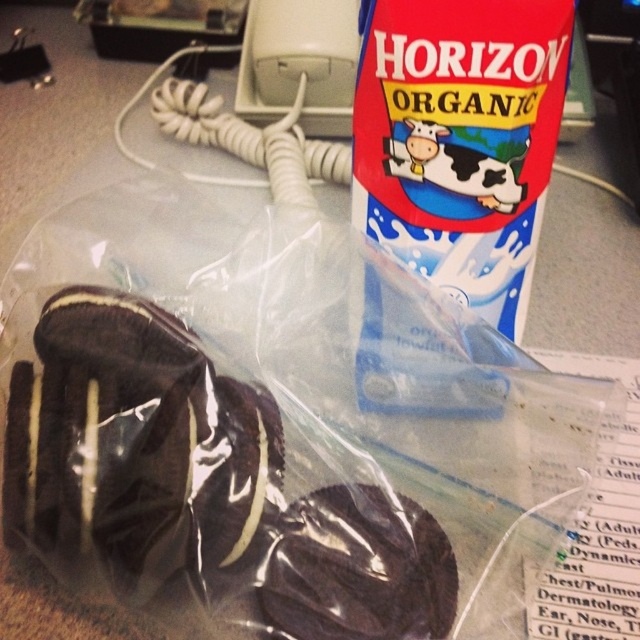
Consider the image. You are holding a ruler and want to measure the distance from your eye to the point marked at coordinates (x=289, y=580) in the image. What is the actual distance in inches?

The point at coordinates (x=289, y=580) is 21.12 inches away from the viewer, so the actual distance is 21.12 inches.